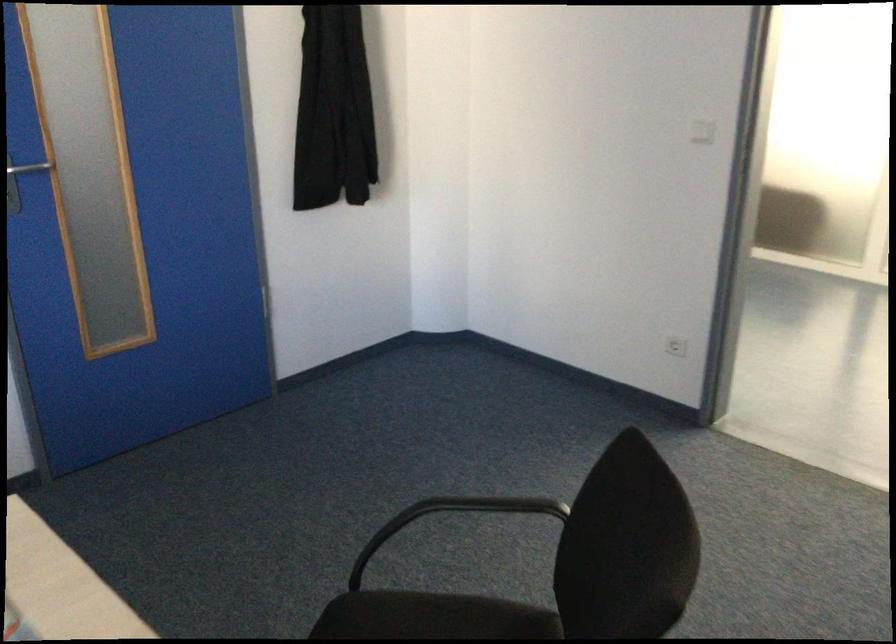
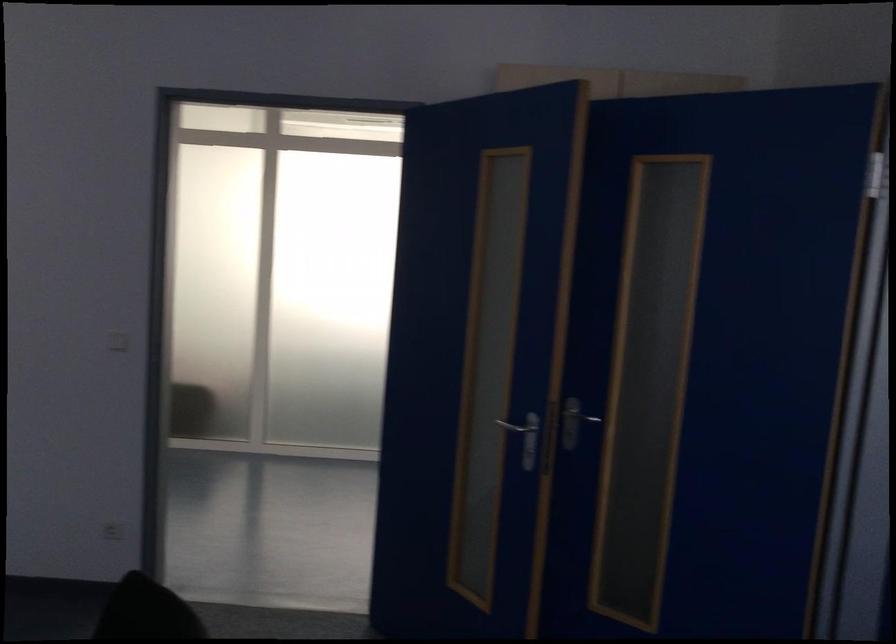
Locate, in the second image, the point that corresponds to (x=665, y=343) in the first image.

(112, 531)